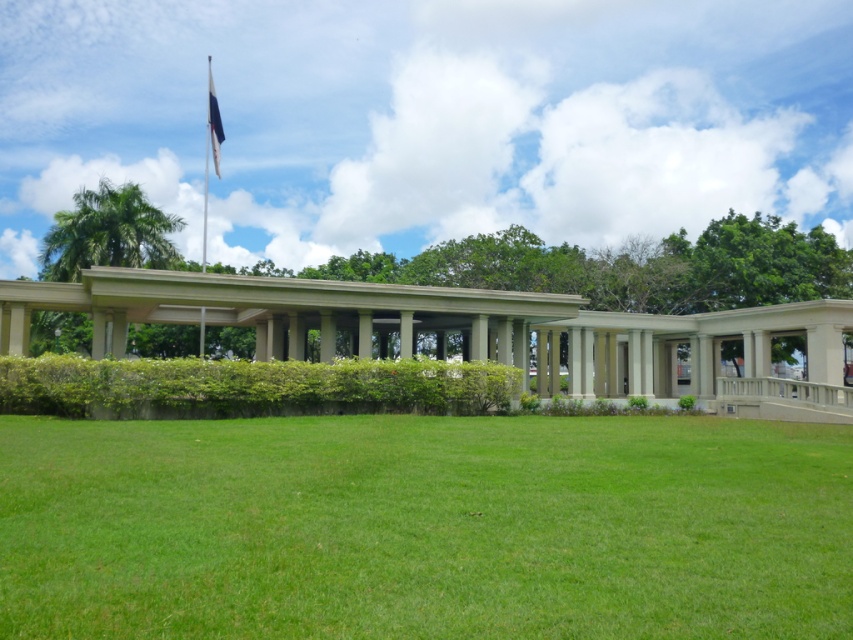
Question: Which is nearer to the green grass at lower center?

Choices:
 (A) beige concrete porch at center
 (B) blue fabric flag at upper center

Answer: (A)

Question: In this image, where is beige concrete porch at center located relative to blue fabric flag at upper center?

Choices:
 (A) left
 (B) right

Answer: (B)

Question: Which object appears farthest from the camera in this image?

Choices:
 (A) beige concrete porch at center
 (B) green grass at lower center

Answer: (A)

Question: Does beige concrete porch at center appear under blue fabric flag at upper center?

Choices:
 (A) no
 (B) yes

Answer: (B)

Question: In this image, where is beige concrete porch at center located relative to blue fabric flag at upper center?

Choices:
 (A) right
 (B) left

Answer: (A)

Question: Based on their relative distances, which object is farther from the beige concrete porch at center?

Choices:
 (A) blue fabric flag at upper center
 (B) green grass at lower center

Answer: (A)